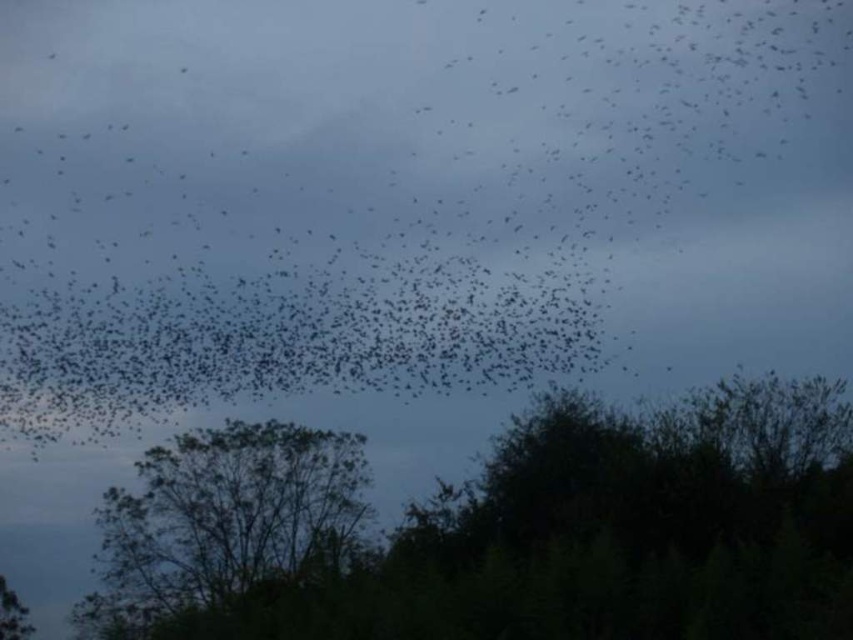
You are standing in the field observing the flock of birds. There are two points in the sky where birds are flying. The first point is at coordinates point (660,412) and the second is at point (351,492). Which of these two points is closer to you?

Point (660,412) is closer to the camera than point (351,492), so the first point is closer to you.

You are an ornithologist observing the scene. You notice the black matte birds at upper center and the green leafy tree at center. Which object is located higher in the image?

The black matte birds at upper center are positioned higher than the green leafy tree at center.